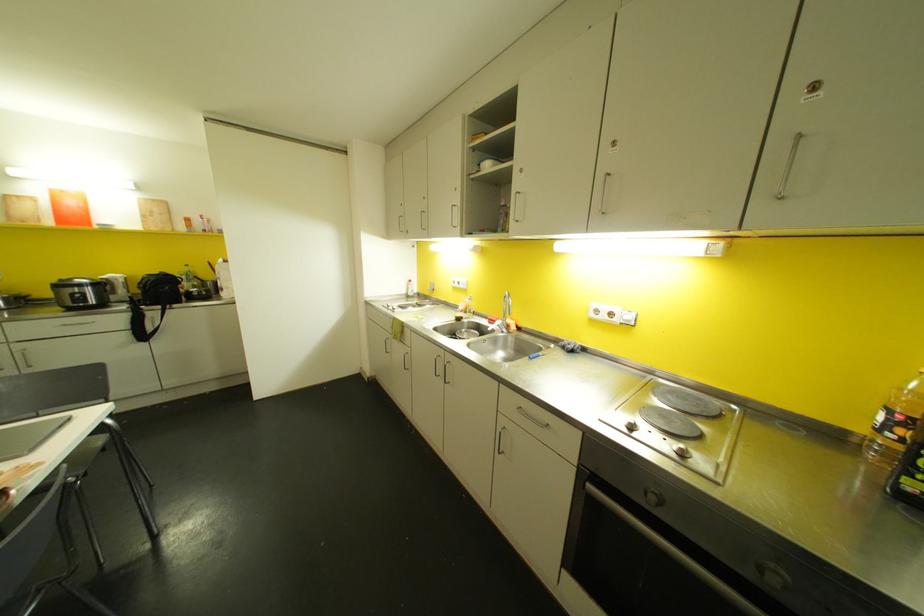
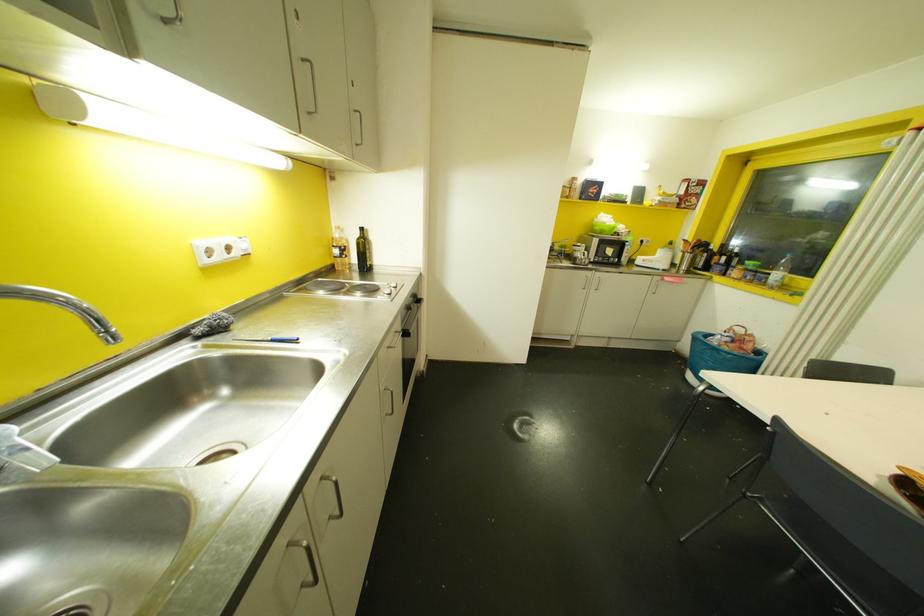
In the second image, find the point that corresponds to (881,416) in the first image.

(335, 251)